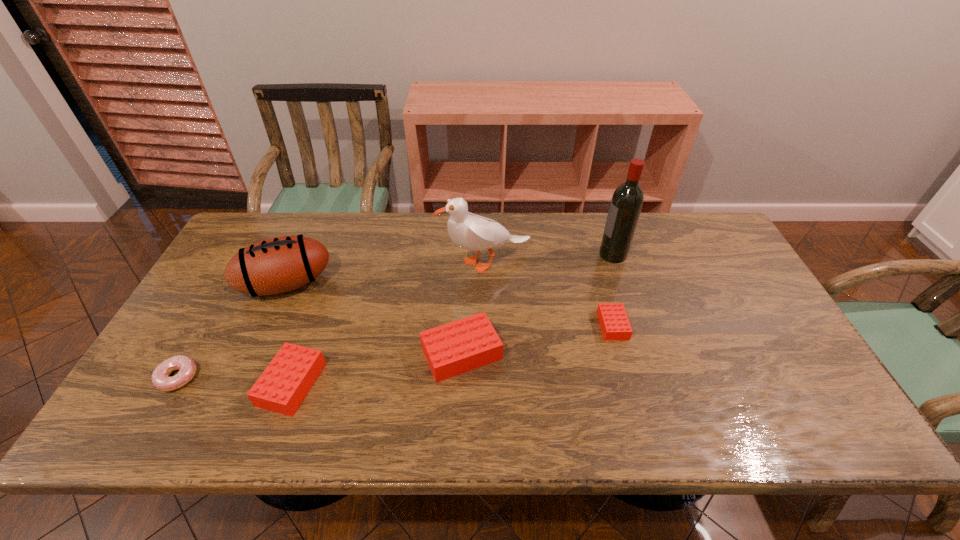
I want to click on vacant space situated 0.160m on the left of the rightmost Lego, so click(x=540, y=326).

Where is `free region located at the beak of the second tallest object`? The image size is (960, 540). free region located at the beak of the second tallest object is located at coordinates (349, 263).

Locate an element on the screen. This screenshot has height=540, width=960. free region located 0.320m at the beak of the second tallest object is located at coordinates (336, 263).

Identify the location of free space located 0.140m at the beak of the second tallest object. (395, 263).

Where is `blank space located on the label of the tallest object`? This screenshot has height=540, width=960. blank space located on the label of the tallest object is located at coordinates (472, 254).

Image resolution: width=960 pixels, height=540 pixels. I want to click on vacant space positioned on the label of the tallest object, so click(x=529, y=254).

In order to click on vacant position located 0.140m on the label of the tallest object in this screenshot , I will do `click(555, 254)`.

Find the location of a particular element. This screenshot has height=540, width=960. vacant space located on the back of the third tallest object is located at coordinates (308, 235).

At what (x,y) coordinates should I click in order to perform the action: click on blank space located on the back of the doughnut. Please return your answer as a coordinate pair (x, y). This screenshot has height=540, width=960. Looking at the image, I should click on (239, 271).

Image resolution: width=960 pixels, height=540 pixels. Identify the location of gull that is positioned at the far edge. (469, 231).